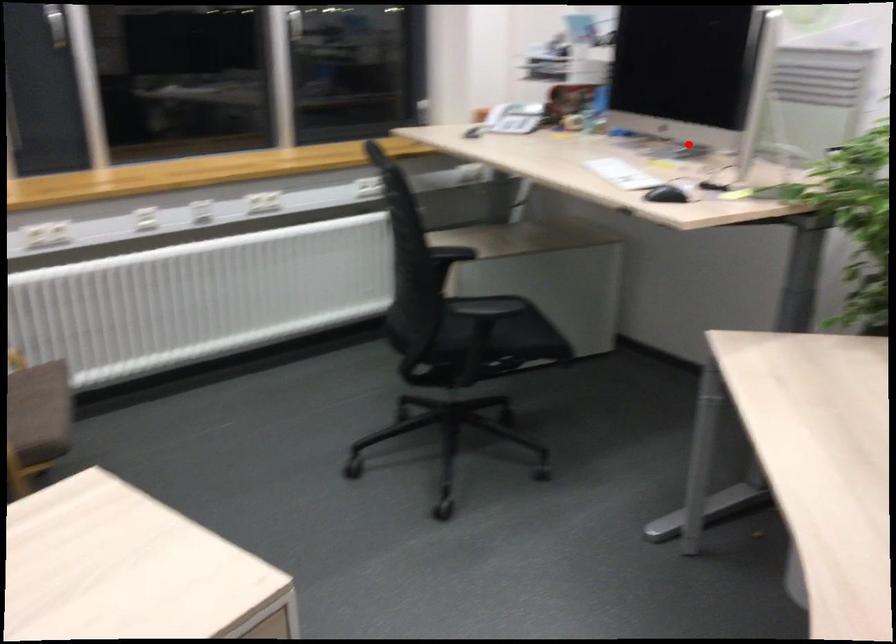
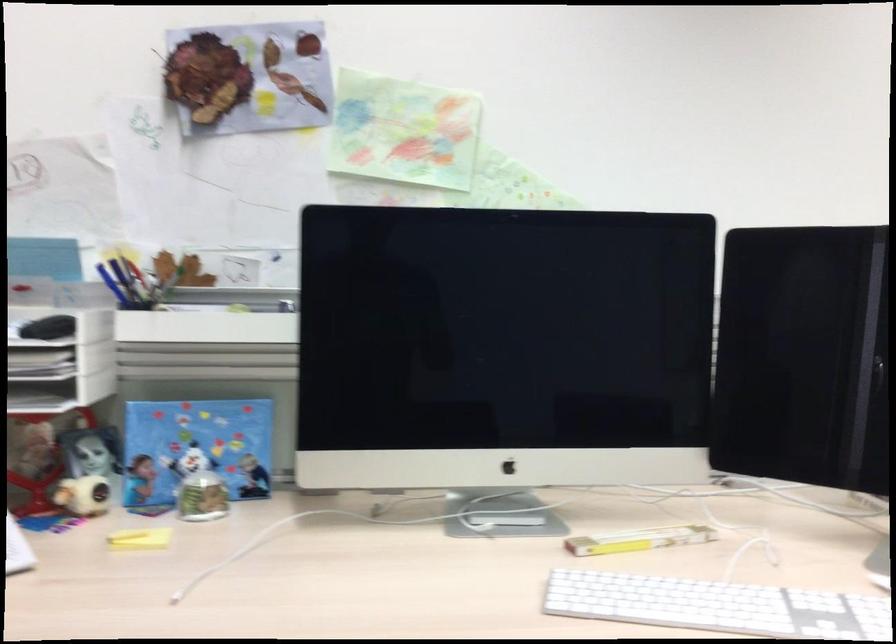
Locate, in the second image, the point that corresponds to the highlighted location in the first image.

(449, 494)